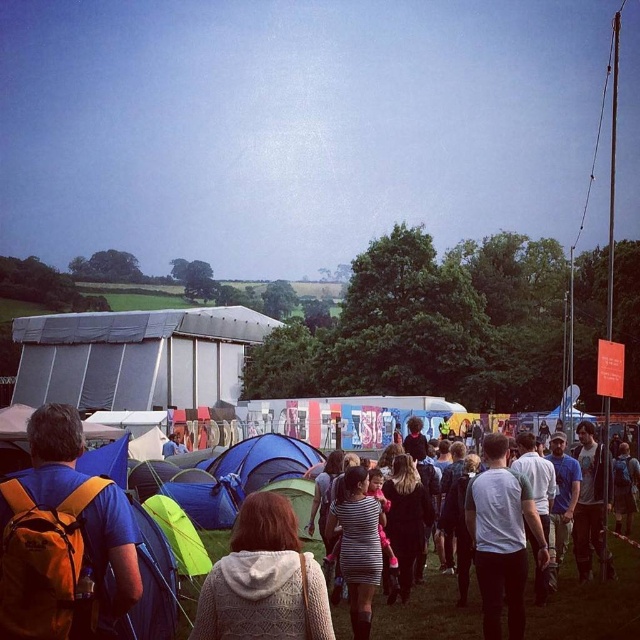
You are a photographer trying to capture the knitted beige sweater at center and the striped fabric dress at center in a single shot. Which of the two items should you focus on first if you want to ensure both are in frame?

The knitted beige sweater at center is below the striped fabric dress at center, so you should focus on the striped fabric dress at center first to ensure both are in frame.

You are organizing a small backpacking trip and need to decide which item to prioritize packing based on their sizes. Given the orange backpack at lower left and the striped fabric dress at center, which one is bigger?

The orange backpack at lower left is larger in size than the striped fabric dress at center, so you should prioritize packing the orange backpack at lower left first.

From the picture: You are at the festival and see two people wearing the knitted beige sweater at center and the white cotton shirt at center. Which one is on the left side?

The knitted beige sweater at center is to the left of the white cotton shirt at center.